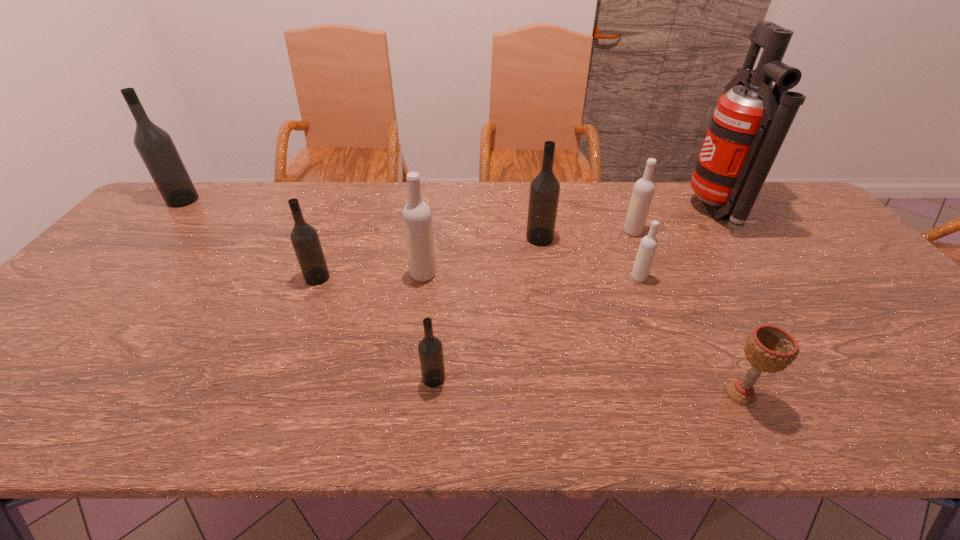
At what (x,y) coordinates should I click in order to perform the action: click on object that is at the far left corner. Please return your answer as a coordinate pair (x, y). Looking at the image, I should click on (155, 146).

Where is `blank space at the far edge of the desktop`? This screenshot has height=540, width=960. blank space at the far edge of the desktop is located at coordinates (282, 199).

I want to click on vacant space at the near edge of the desktop, so click(52, 400).

Where is `vacant space at the right edge`? This screenshot has width=960, height=540. vacant space at the right edge is located at coordinates (792, 246).

You are a GUI agent. You are given a task and a screenshot of the screen. Output one action in this format:
    pyautogui.click(x=<x>, y=<y>)
    Task: Click on the free space between the third black vodka from left to right and the rightmost object
    
    Given the screenshot: What is the action you would take?
    pyautogui.click(x=574, y=294)

You are a GUI agent. You are given a task and a screenshot of the screen. Output one action in this format:
    pyautogui.click(x=<x>, y=<y>)
    Task: Click on the vacant region between the eighth object from left to right and the tallest vodka
    
    Given the screenshot: What is the action you would take?
    pyautogui.click(x=462, y=297)

Where is `empty location between the smallest white vodka and the second smallest white vodka`? Image resolution: width=960 pixels, height=540 pixels. empty location between the smallest white vodka and the second smallest white vodka is located at coordinates (636, 255).

Locate an element on the screen. This screenshot has width=960, height=540. free space between the red fire extinguisher and the farthest black vodka is located at coordinates (449, 205).

Locate an element on the screen. free spot between the second black vodka from right to left and the smallest white vodka is located at coordinates (537, 328).

Image resolution: width=960 pixels, height=540 pixels. Find the location of `free space between the nearest black vodka and the farthest white vodka`. free space between the nearest black vodka and the farthest white vodka is located at coordinates (533, 305).